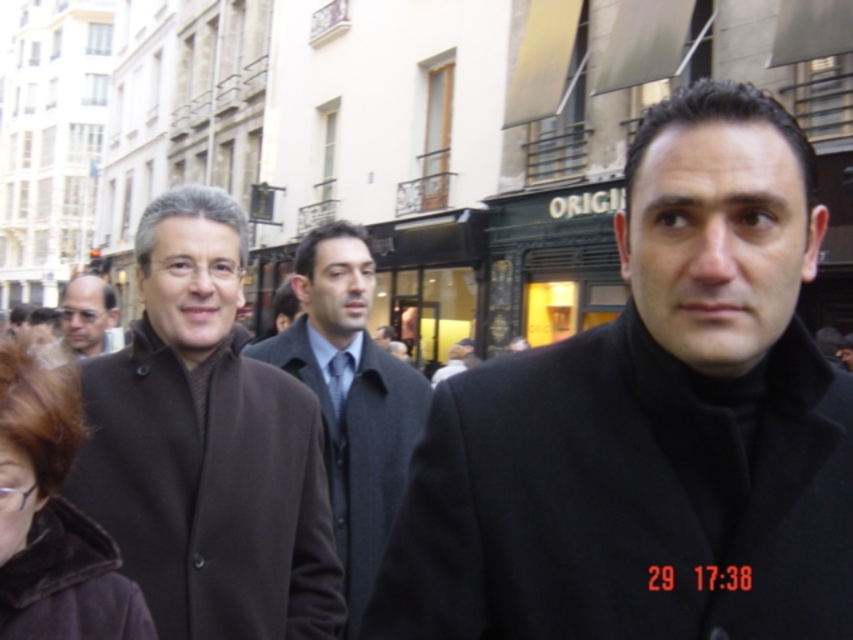
You are a photographer standing in front of the European street scene. You notice two coats in the center of the image. Which coat is positioned lower in the frame, the brown wool coat at center or the dark gray wool coat at center?

The brown wool coat at center is located below the dark gray wool coat at center, so it is positioned lower in the frame.

You are standing at the camera position and want to hand a document to the person wearing the brown wool coat at center. Which direction should you move to approach them?

Since the brown wool coat at center is located at point 0.698 on the x axis and 0.244 on the y axis, you should move forward towards the center of the scene to reach them.